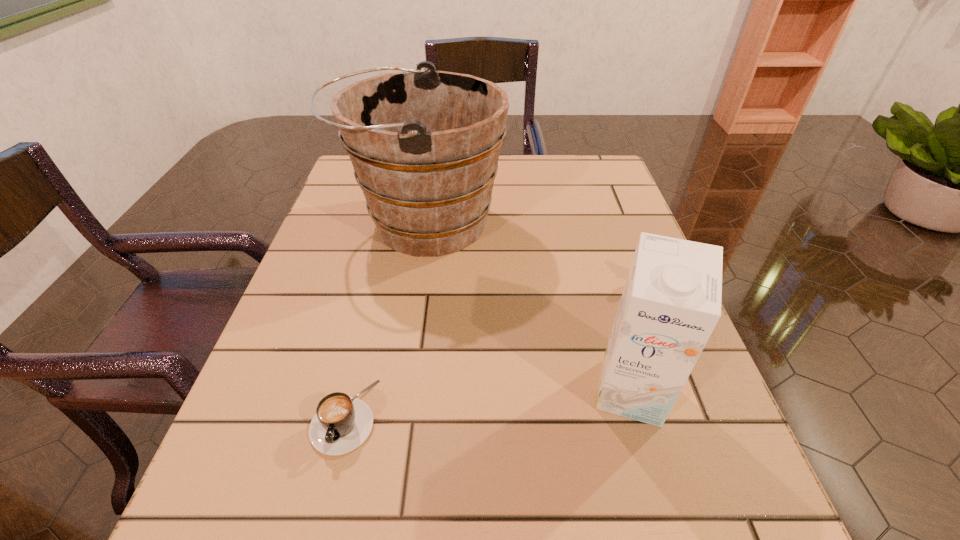
At what (x,y) coordinates should I click in order to perform the action: click on free location at the near edge. Please return your answer as a coordinate pair (x, y). The image size is (960, 540). Looking at the image, I should click on (389, 504).

At what (x,y) coordinates should I click in order to perform the action: click on free space at the left edge of the desktop. Please return your answer as a coordinate pair (x, y). The width and height of the screenshot is (960, 540). Looking at the image, I should click on (345, 204).

I want to click on vacant area at the right edge, so click(587, 227).

This screenshot has height=540, width=960. Find the location of `free space at the far right corner of the desktop`. free space at the far right corner of the desktop is located at coordinates tap(593, 192).

Locate an element on the screen. The height and width of the screenshot is (540, 960). vacant region between the carton and the cappuccino is located at coordinates (488, 404).

You are a GUI agent. You are given a task and a screenshot of the screen. Output one action in this format:
    pyautogui.click(x=<x>, y=<y>)
    Task: Click on the free space between the cappuccino and the farthest object
    
    Given the screenshot: What is the action you would take?
    pyautogui.click(x=384, y=319)

In order to click on unoccupied area between the carton and the farthest object in this screenshot , I will do `click(527, 307)`.

This screenshot has width=960, height=540. Identify the location of free space between the carton and the shortest object. (488, 404).

Find the location of a particular element. This screenshot has width=960, height=540. free space that is in between the farthest object and the shortest object is located at coordinates (384, 319).

This screenshot has height=540, width=960. I want to click on free spot between the shortest object and the bucket, so click(x=384, y=319).